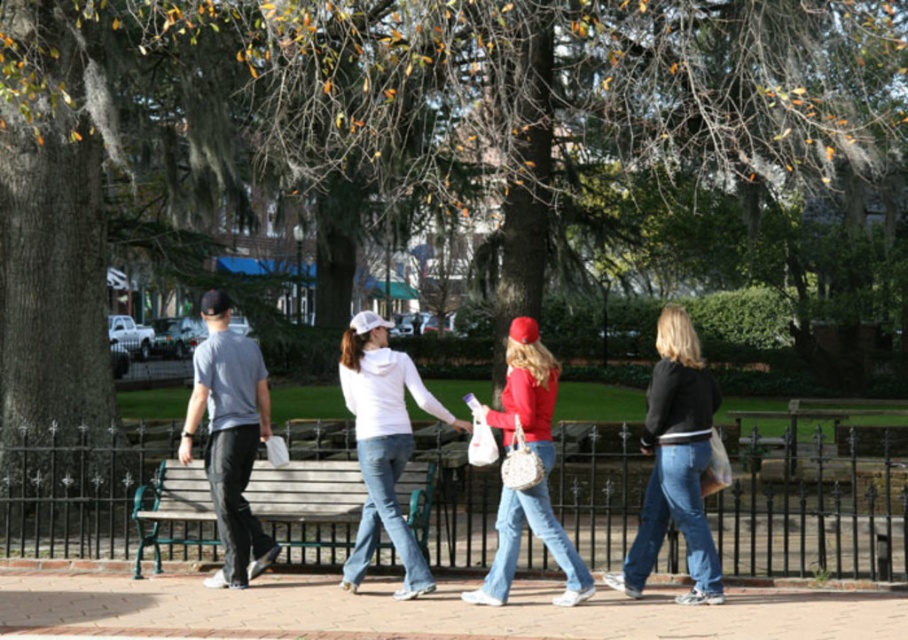
You are standing on the path and want to sit down. There is a wooden bench at center and a white matte hoodie at center. Which object is higher up from the ground?

The wooden bench at center is located above the white matte hoodie at center, so the wooden bench at center is higher up from the ground.